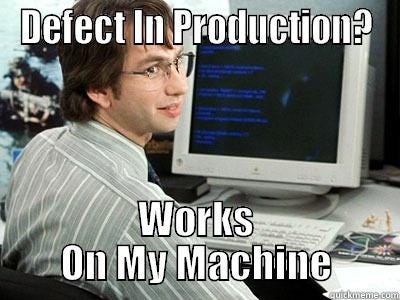
Where is `mouse`? The width and height of the screenshot is (400, 300). mouse is located at coordinates coord(397,244).